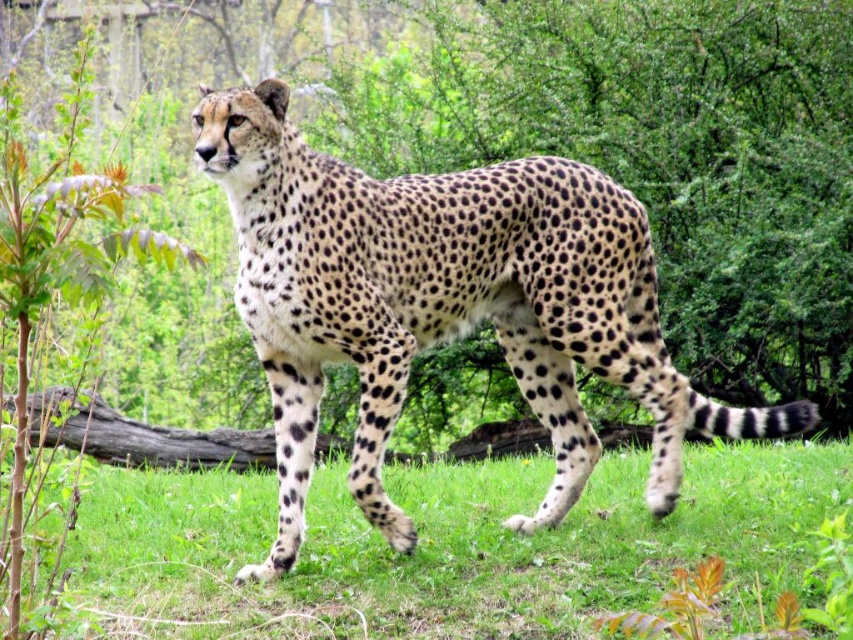
Based on the photo, you are a wildlife photographer aiming to capture the cheetah in the image. You want to position your camera exactly 5 meters away from the point labeled as point (345,196). Is the current camera position at 4.47 meters sufficient to achieve this requirement?

The distance of point (345,196) from the camera is currently 4.47 meters. Since you need to be exactly 5 meters away, you should move your camera back by approximately 0.53 meters to meet the requirement.

You are a wildlife photographer standing at the origin point of the coordinate system. You want to take a photo of the spotted fur cheetah at center. What are the coordinates where you should aim your camera?

The coordinates to aim your camera are at point (444, 304) where the spotted fur cheetah at center is located.

You are a wildlife photographer aiming to capture the spotted fur cheetah at center and the green soft grass at lower center in a single frame. Based on their sizes, which object should you focus on first to ensure both are in the frame?

The spotted fur cheetah at center is smaller than the green soft grass at lower center. To ensure both are in the frame, focus on the spotted fur cheetah at center first since it is smaller and requires precise framing to include the larger green soft grass at lower center.